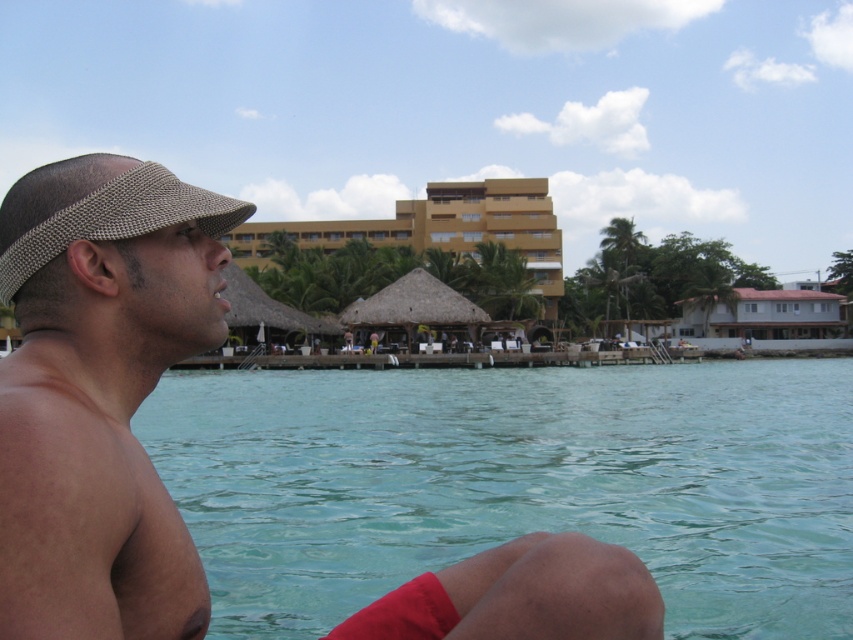
You are a photographer taking a picture of the beach scene. You notice two visors at the left side of the image. Which one is positioned more to the right between the knitted beige visor at left and the woven fabric visor at left?

The knitted beige visor at left is positioned more to the right compared to the woven fabric visor at left.

You are standing at the point labeled point (9, 292) and want to walk towards the point labeled point (819, 330). Based on the scene description, will you be walking towards the beach or away from it?

Since point (9, 292) is in front of point (819, 330), you will be walking away from the beach towards the point (819, 330).